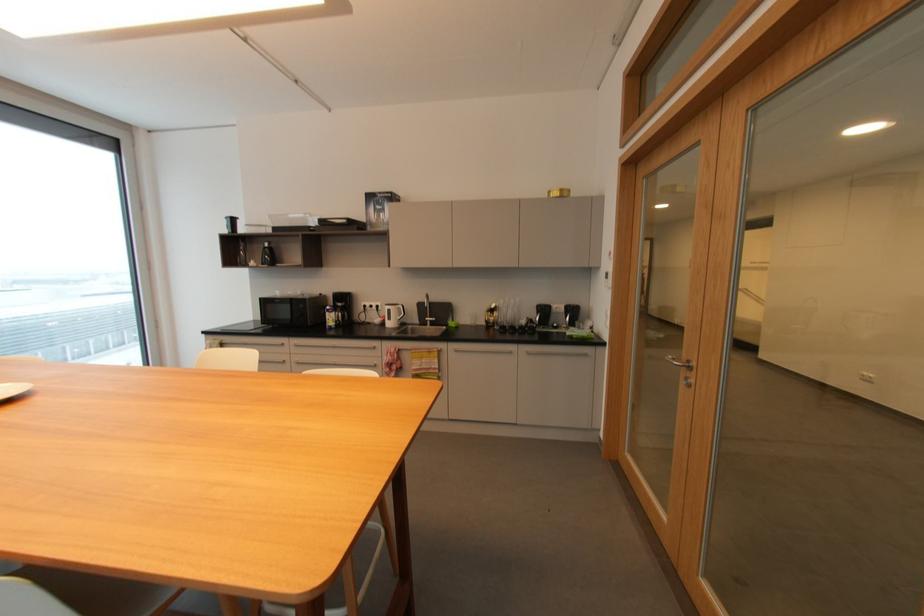
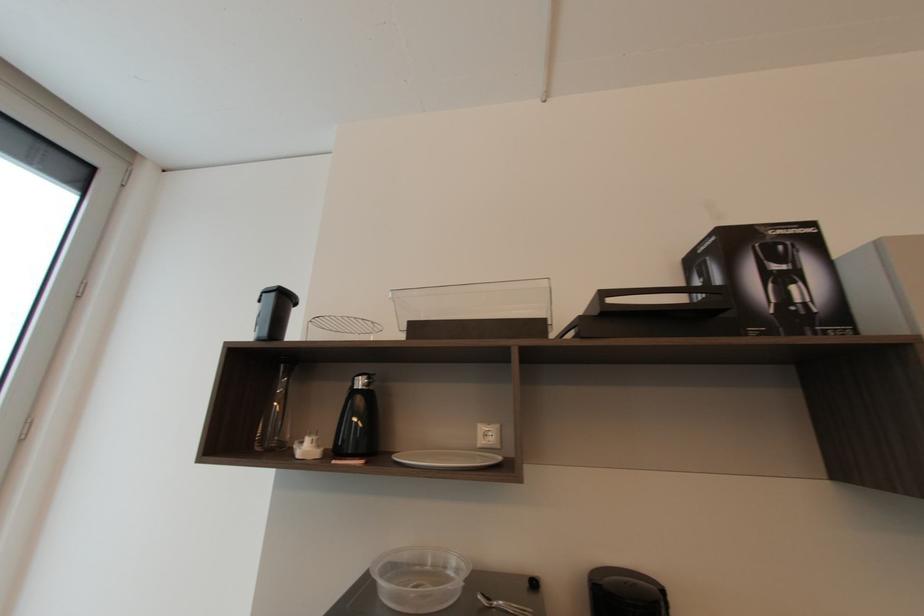
Find the pixel in the second image that matches (x=271, y=245) in the first image.

(362, 384)